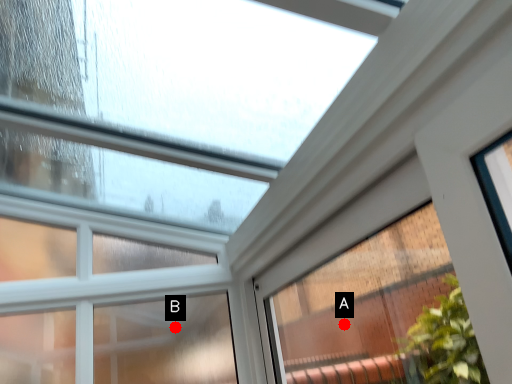
Question: Two points are circled on the image, labeled by A and B beside each circle. Which point is farther to the camera?

Choices:
 (A) A is further
 (B) B is further

Answer: (A)